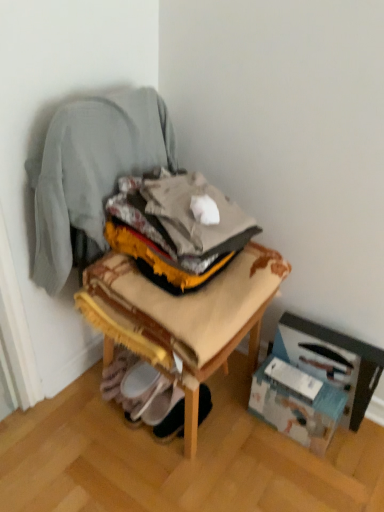
Locate an element on the screen. The width and height of the screenshot is (384, 512). empty space that is ontop of teal cardboard box at lower right, which is the 2th cardboard box in right-to-left order (from a real-world perspective) is located at coordinates tap(309, 386).